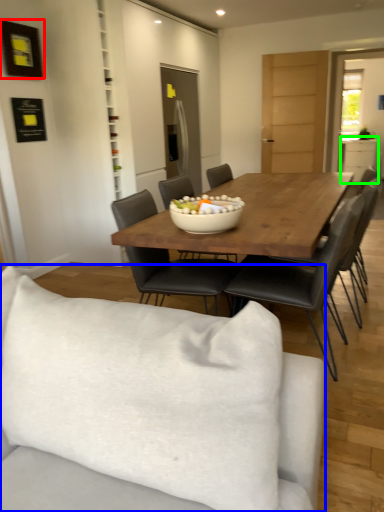
Question: Considering the real-world distances, which object is farthest from picture frame (highlighted by a red box)? studio couch (highlighted by a blue box) or cabinetry (highlighted by a green box)?

Choices:
 (A) studio couch
 (B) cabinetry

Answer: (B)